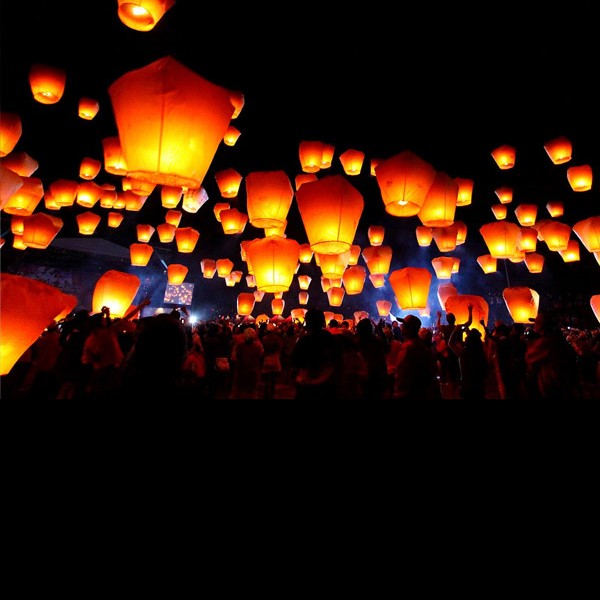
This screenshot has width=600, height=600. I want to click on white lights, so click(193, 318), click(424, 322).